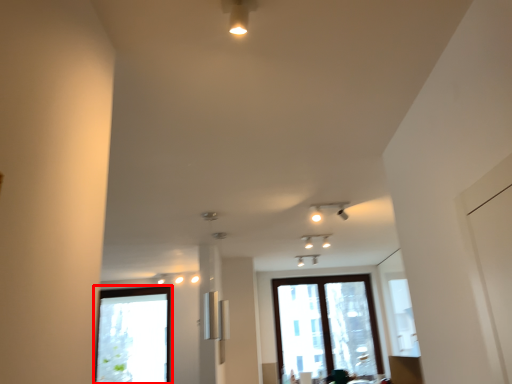
Question: From the image, what is the correct spatial relationship of window (annotated by the red box) in relation to window?

Choices:
 (A) left
 (B) right

Answer: (A)